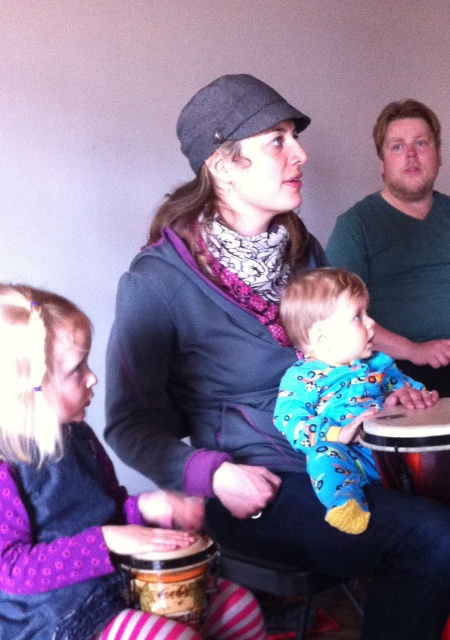
Question: Where is green matte shirt at upper right located in relation to wooden drum at lower left in the image?

Choices:
 (A) above
 (B) below

Answer: (A)

Question: Is floral pajamas at center behind wooden drum at lower left?

Choices:
 (A) yes
 (B) no

Answer: (A)

Question: Which of the following is the closest to the observer?

Choices:
 (A) wooden drum at lower left
 (B) brown textured drum at center

Answer: (A)

Question: Can you confirm if purple fleece dress at lower left is positioned above floral pajamas at center?

Choices:
 (A) no
 (B) yes

Answer: (A)

Question: Which object appears closest to the camera in this image?

Choices:
 (A) matte gray cap at center
 (B) wooden drum at lower left
 (C) green matte shirt at upper right
 (D) floral pajamas at center

Answer: (B)

Question: Which of these objects is positioned farthest from the green matte shirt at upper right?

Choices:
 (A) purple fleece dress at lower left
 (B) wooden drum at lower left

Answer: (B)